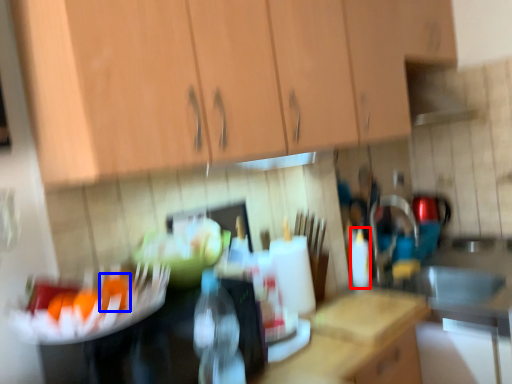
Question: Which point is closer to the camera, bottle (highlighted by a red box) or food (highlighted by a blue box)?

Choices:
 (A) bottle
 (B) food

Answer: (B)